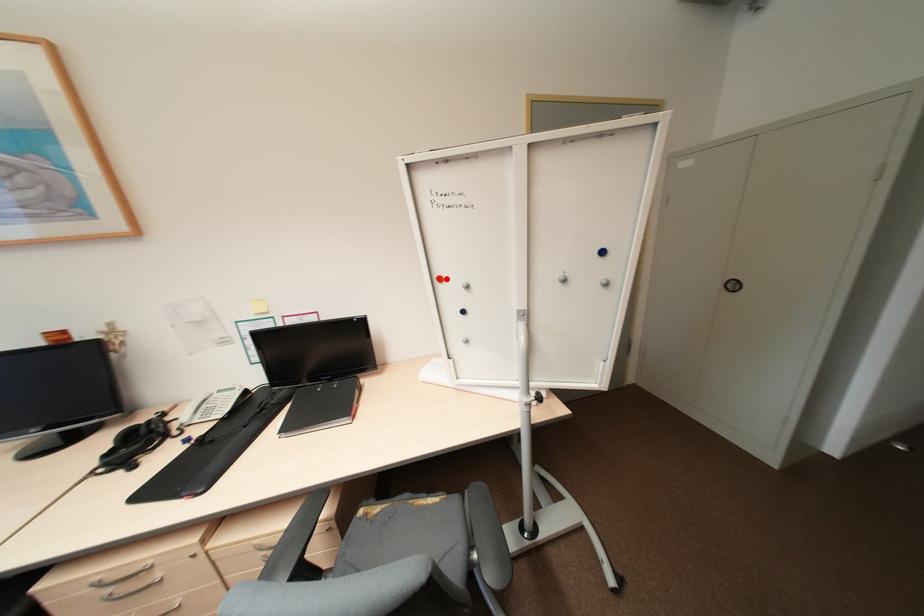
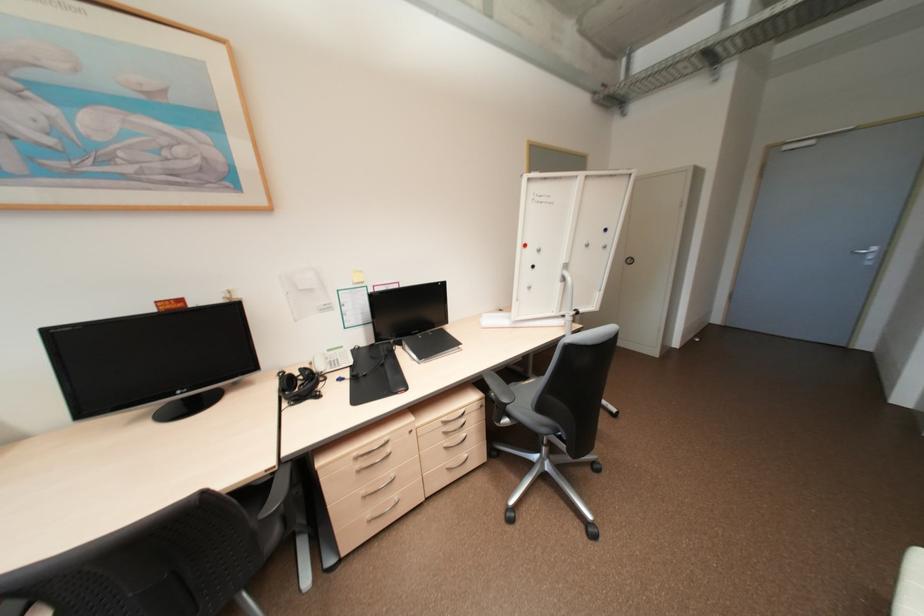
Where in the second image is the point corresponding to the highlighted location from the first image?

(530, 245)